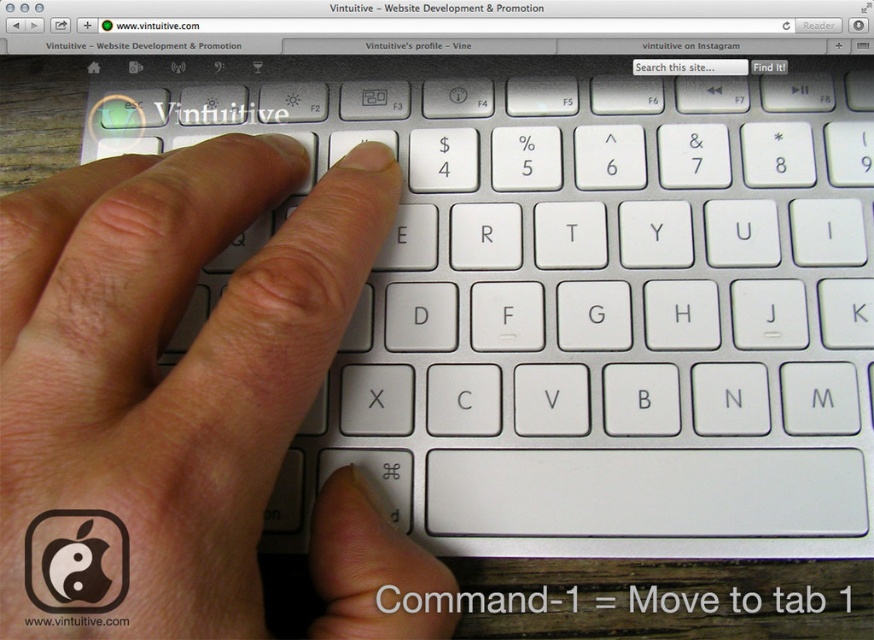
Does white plastic keyboard at center appear on the left side of white matte finger at center?

In fact, white plastic keyboard at center is to the right of white matte finger at center.

Between white plastic keyboard at center and white matte finger at center, which one is positioned lower?

→ white matte finger at center

Does point (463, 216) lie behind point (161, 452)?

Yes.

Locate an element on the screen. white plastic keyboard at center is located at coordinates (579, 296).